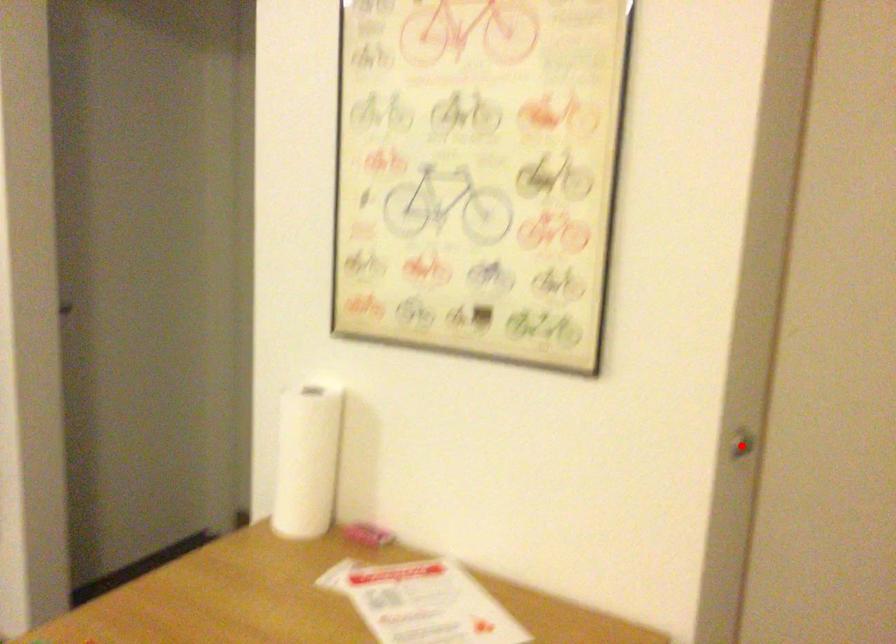
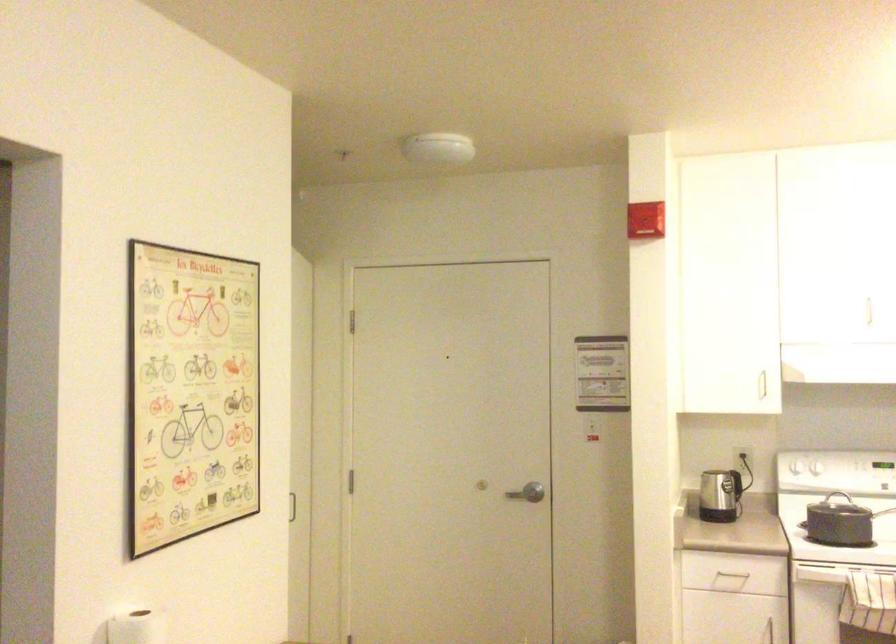
Question: I am providing you with two images of the same scene from different viewpoints. A red point is marked on the first image. At the location where the point appears in image 1, is it still visible in image 2?

Choices:
 (A) Yes
 (B) No

Answer: (B)